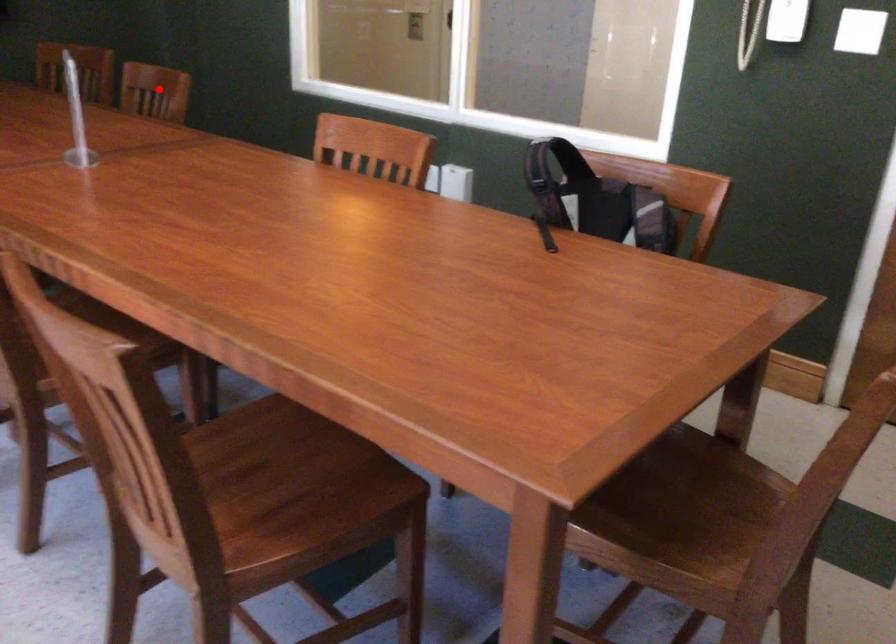
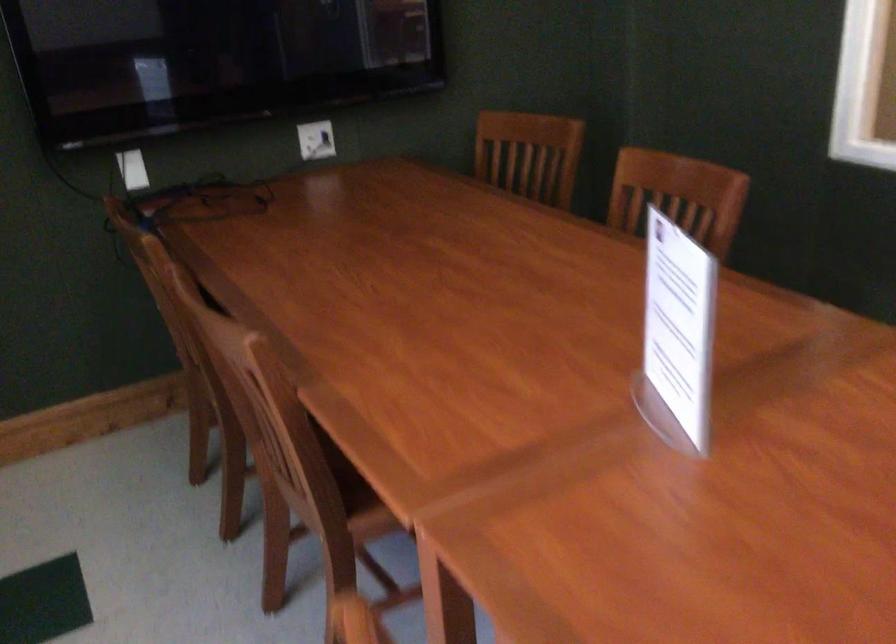
Question: I am providing you with two images of the same scene from different viewpoints. A red point is marked on the first image. At the location where the point appears in image 1, is it still visible in image 2?

Choices:
 (A) Yes
 (B) No

Answer: (A)